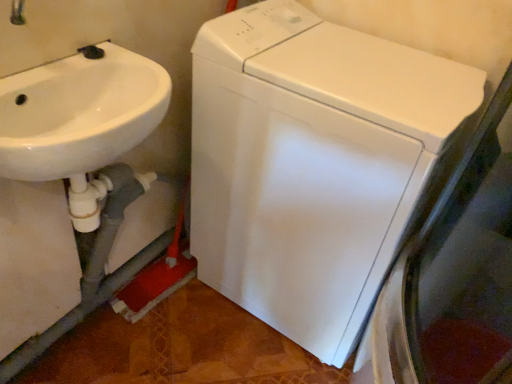
Question: Considering the relative positions of white glossy sink at left and white glossy washing machine at center in the image provided, is white glossy sink at left to the left of white glossy washing machine at center from the viewer's perspective?

Choices:
 (A) yes
 (B) no

Answer: (A)

Question: Is white glossy sink at left beside white glossy washing machine at center?

Choices:
 (A) no
 (B) yes

Answer: (A)

Question: From the image's perspective, is white glossy sink at left beneath white glossy washing machine at center?

Choices:
 (A) yes
 (B) no

Answer: (B)

Question: Is white glossy sink at left not near white glossy washing machine at center?

Choices:
 (A) no
 (B) yes

Answer: (A)

Question: Is white glossy sink at left positioned before white glossy washing machine at center?

Choices:
 (A) yes
 (B) no

Answer: (A)

Question: From a real-world perspective, does white glossy sink at left stand above white glossy washing machine at center?

Choices:
 (A) yes
 (B) no

Answer: (A)

Question: Considering the relative positions of white glossy washing machine at center and white glossy sink at left in the image provided, is white glossy washing machine at center in front of white glossy sink at left?

Choices:
 (A) yes
 (B) no

Answer: (B)

Question: Does white glossy washing machine at center have a greater height compared to white glossy sink at left?

Choices:
 (A) no
 (B) yes

Answer: (B)

Question: Is white glossy washing machine at center oriented away from white glossy sink at left?

Choices:
 (A) no
 (B) yes

Answer: (A)

Question: Is white glossy washing machine at center positioned beyond the bounds of white glossy sink at left?

Choices:
 (A) no
 (B) yes

Answer: (B)

Question: Does white glossy washing machine at center lie behind white glossy sink at left?

Choices:
 (A) yes
 (B) no

Answer: (A)

Question: Does white glossy washing machine at center have a larger size compared to white glossy sink at left?

Choices:
 (A) yes
 (B) no

Answer: (A)

Question: Is white glossy washing machine at center wider or thinner than white glossy sink at left?

Choices:
 (A) wide
 (B) thin

Answer: (A)